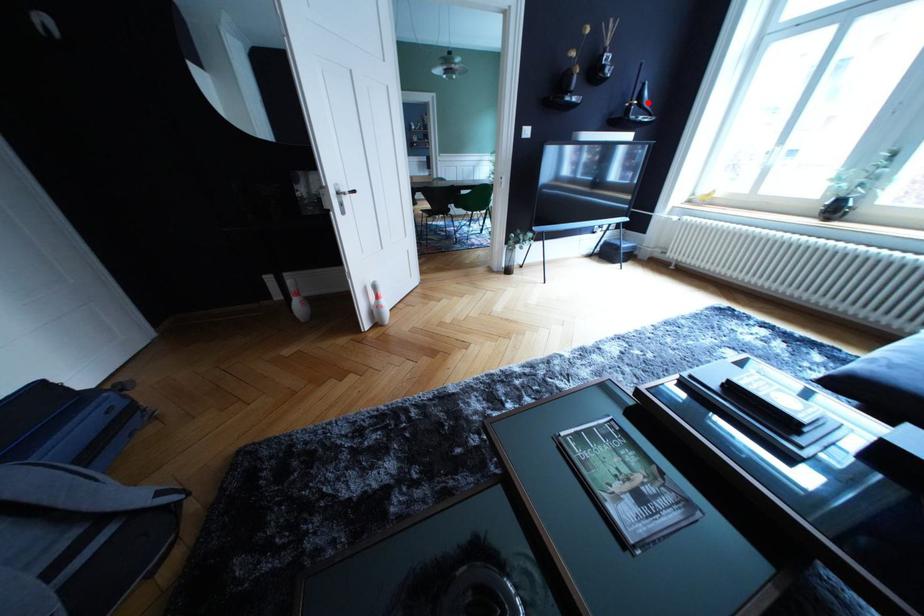
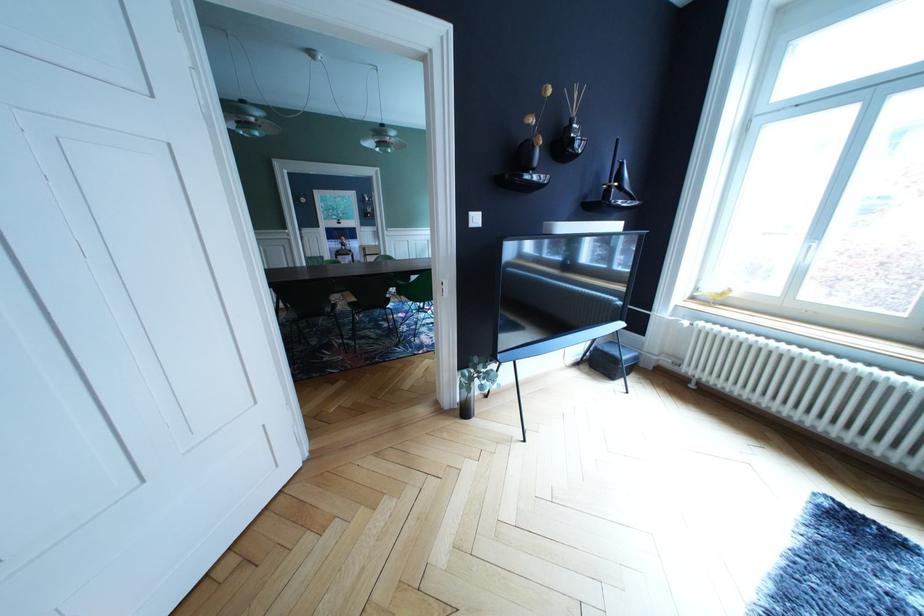
Where in the second image is the point corresponding to the highlighted location from the first image?

(628, 184)